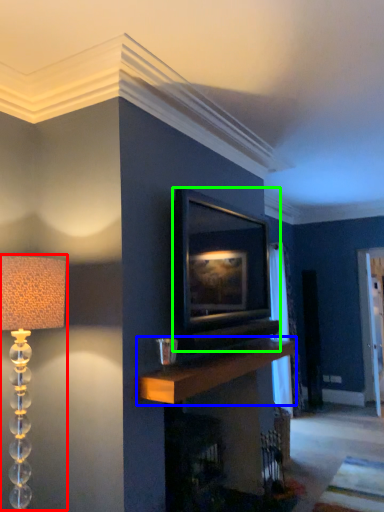
Question: Which object is the farthest from lamp (highlighted by a red box)? Choose among these: mantle (highlighted by a blue box) or picture frame (highlighted by a green box).

Choices:
 (A) mantle
 (B) picture frame

Answer: (B)